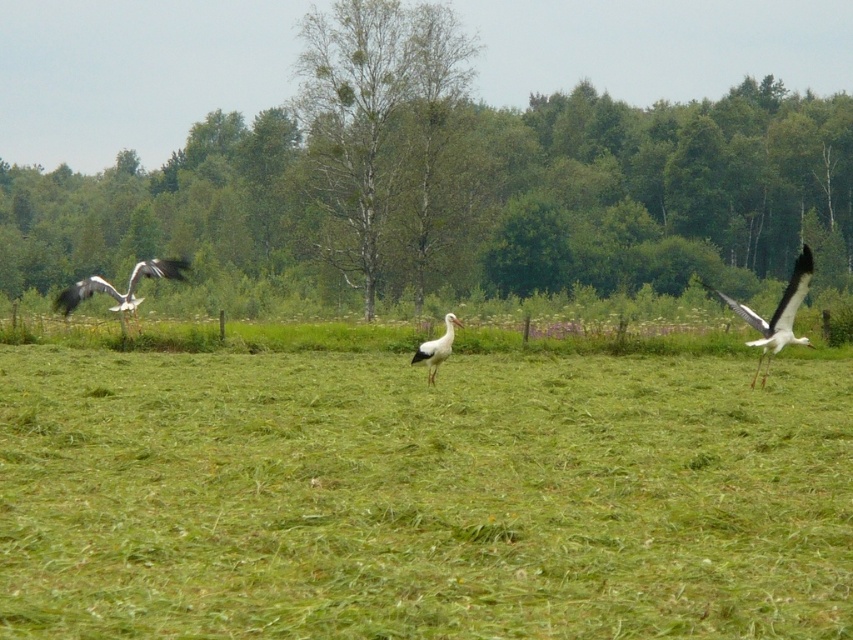
Does white feathered stork at left appear on the right side of white matte stork at center?

No, white feathered stork at left is not to the right of white matte stork at center.

Between white feathered stork at left and white matte stork at center, which one is positioned lower?

white matte stork at center is lower down.

What do you see at coordinates (119, 291) in the screenshot? I see `white feathered stork at left` at bounding box center [119, 291].

Locate an element on the screen. white feathered stork at left is located at coordinates (119, 291).

Who is positioned more to the right, green bark tree at center or white feathered stork at left?

Positioned to the right is green bark tree at center.

Where is `green bark tree at center`? The height and width of the screenshot is (640, 853). green bark tree at center is located at coordinates (383, 132).

Locate an element on the screen. The height and width of the screenshot is (640, 853). green bark tree at center is located at coordinates click(383, 132).

Is point (260, 129) positioned behind point (318, 88)?

Yes, it is.

Who is positioned more to the left, green leafy tree at center or green bark tree at center?

From the viewer's perspective, green bark tree at center appears more on the left side.

Is point (495, 163) positioned after point (373, 241)?

Yes.

Identify the location of green leafy tree at center. The image size is (853, 640). (453, 180).